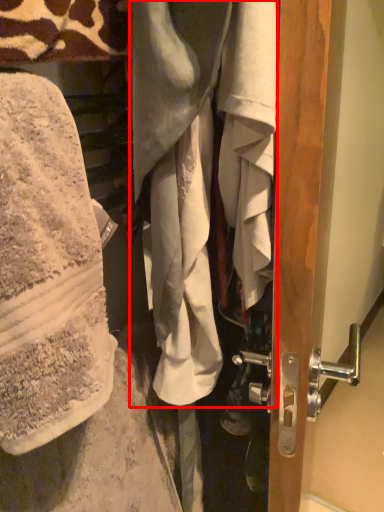
Question: Observing the image, what is the correct spatial positioning of wrap (annotated by the red box) in reference to wrap?

Choices:
 (A) right
 (B) left

Answer: (A)